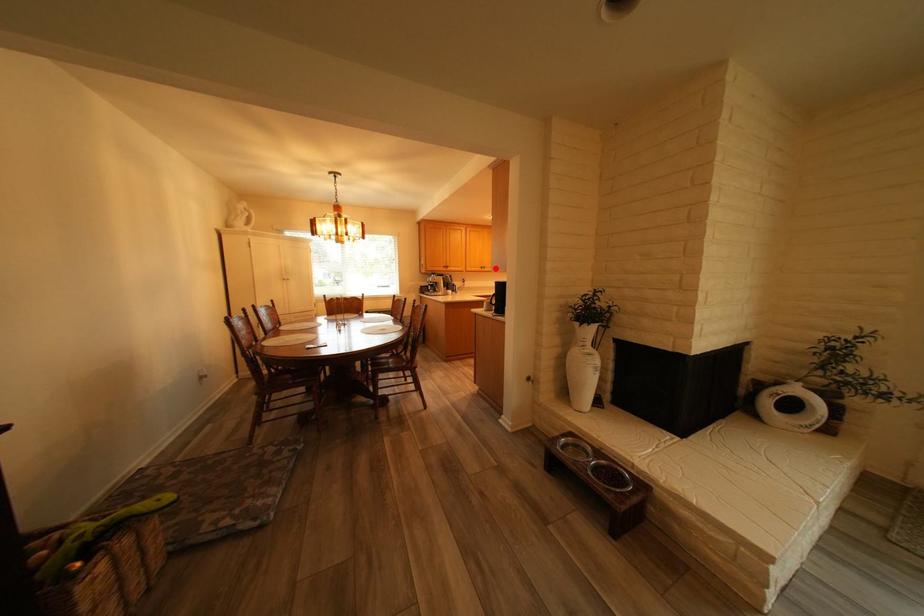
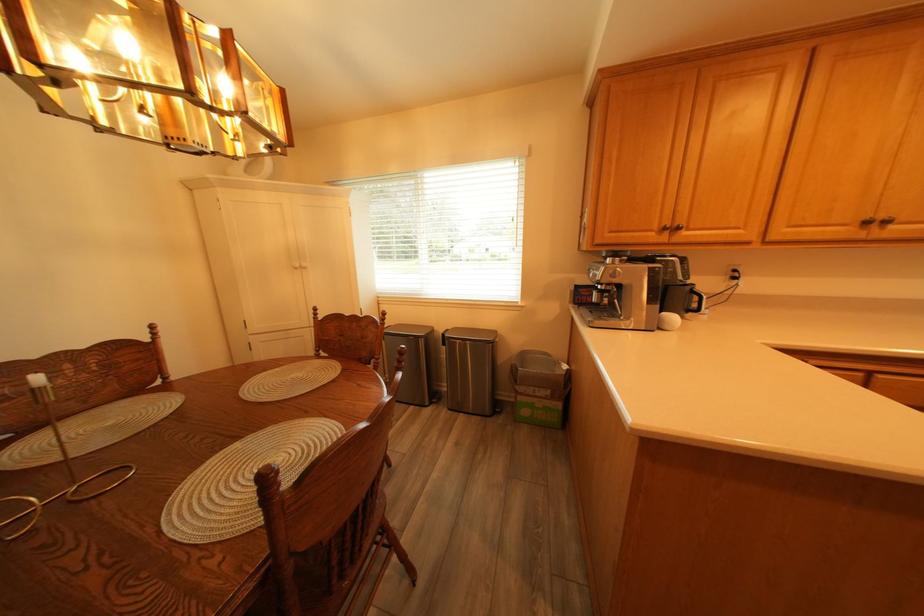
Question: I am providing you with two images of the same scene from different viewpoints. In image1, a red point is highlighted. Considering the same 3D point in image2, which of the following is correct?

Choices:
 (A) It is closer
 (B) It is farther

Answer: (B)